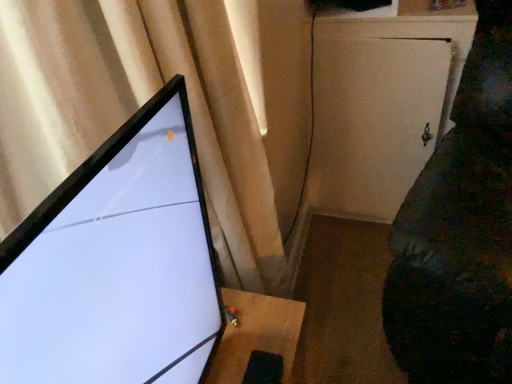
Identify the location of matte beige curtain at upper left. The height and width of the screenshot is (384, 512). (134, 111).

Find the location of a particular element. The width and height of the screenshot is (512, 384). matte beige curtain at upper left is located at coordinates (134, 111).

Is velvet dark green couch at right aimed at matte black monitor at left?

No, velvet dark green couch at right is not aimed at matte black monitor at left.

From the image's perspective, is velvet dark green couch at right located above matte black monitor at left?

Yes.

Is velvet dark green couch at right beside matte black monitor at left?

velvet dark green couch at right and matte black monitor at left are clearly separated.

Between velvet dark green couch at right and matte black monitor at left, which one appears on the right side from the viewer's perspective?

velvet dark green couch at right is more to the right.

Is white matte cabinet at right completely or partially outside of matte black monitor at left?

Yes, white matte cabinet at right is located beyond the bounds of matte black monitor at left.

Considering the positions of objects white matte cabinet at right and matte black monitor at left in the image provided, who is in front, white matte cabinet at right or matte black monitor at left?

Positioned in front is matte black monitor at left.

Can you confirm if white matte cabinet at right is wider than matte black monitor at left?

Yes, white matte cabinet at right is wider than matte black monitor at left.

Is matte beige curtain at upper left far from white matte cabinet at right?

matte beige curtain at upper left is actually quite close to white matte cabinet at right.

Is matte beige curtain at upper left bigger than white matte cabinet at right?

Indeed, matte beige curtain at upper left has a larger size compared to white matte cabinet at right.

Does matte beige curtain at upper left appear on the left side of white matte cabinet at right?

Yes.

Could you tell me if matte black monitor at left is turned towards matte beige curtain at upper left?

No.

Considering the sizes of objects matte black monitor at left and matte beige curtain at upper left in the image provided, who is bigger, matte black monitor at left or matte beige curtain at upper left?

Bigger between the two is matte beige curtain at upper left.

Is point (4, 268) in front of point (85, 48)?

Yes, it is in front of point (85, 48).

In the image, is matte black monitor at left positioned in front of or behind matte beige curtain at upper left?

Visually, matte black monitor at left is located in front of matte beige curtain at upper left.

Which object is positioned more to the right, velvet dark green couch at right or white matte cabinet at right?

velvet dark green couch at right.

Between velvet dark green couch at right and white matte cabinet at right, which one has smaller width?

white matte cabinet at right.

At what (x,y) coordinates should I click in order to perform the action: click on screen door above the velvet dark green couch at right (from a real-world perspective). Please return your answer as a coordinate pair (x, y). This screenshot has width=512, height=384. Looking at the image, I should click on (374, 122).

Is white matte cabinet at right a part of velvet dark green couch at right?

Actually, white matte cabinet at right is outside velvet dark green couch at right.

Is matte beige curtain at upper left not close to velvet dark green couch at right?

That's not correct — matte beige curtain at upper left is a little close to velvet dark green couch at right.

Between matte beige curtain at upper left and velvet dark green couch at right, which one has more height?

matte beige curtain at upper left is taller.

Considering the relative positions of matte beige curtain at upper left and velvet dark green couch at right in the image provided, is matte beige curtain at upper left to the left or to the right of velvet dark green couch at right?

Clearly, matte beige curtain at upper left is on the left of velvet dark green couch at right in the image.

Consider the image. Between matte beige curtain at upper left and velvet dark green couch at right, which one is positioned behind?

velvet dark green couch at right.

From the image's perspective, is matte black monitor at left under velvet dark green couch at right?

Yes, from the image's perspective, matte black monitor at left is below velvet dark green couch at right.

Which is more to the right, matte black monitor at left or velvet dark green couch at right?

velvet dark green couch at right.

Find the location of a particular element. This screenshot has height=384, width=512. computer monitor that is above the velvet dark green couch at right (from a real-world perspective) is located at coordinates (115, 263).

Identify the location of computer monitor to the left of velvet dark green couch at right. The image size is (512, 384). (115, 263).

You are a GUI agent. You are given a task and a screenshot of the screen. Output one action in this format:
    pyautogui.click(x=<x>, y=<y>)
    Task: Click on the screen door on the right of matte black monitor at left
    
    Given the screenshot: What is the action you would take?
    pyautogui.click(x=374, y=122)

When comparing their distances from matte beige curtain at upper left, does velvet dark green couch at right or matte black monitor at left seem further?

Among the two, velvet dark green couch at right is located further to matte beige curtain at upper left.

Considering their positions, is matte beige curtain at upper left positioned further to white matte cabinet at right than velvet dark green couch at right?

The object further to white matte cabinet at right is matte beige curtain at upper left.

When comparing their distances from white matte cabinet at right, does matte black monitor at left or velvet dark green couch at right seem closer?

velvet dark green couch at right.

From the image, which object appears to be farther from matte beige curtain at upper left, matte black monitor at left or velvet dark green couch at right?

velvet dark green couch at right is positioned further to the anchor matte beige curtain at upper left.

Estimate the real-world distances between objects in this image. Which object is closer to velvet dark green couch at right, matte black monitor at left or matte beige curtain at upper left?

Based on the image, matte beige curtain at upper left appears to be nearer to velvet dark green couch at right.

Considering their positions, is matte beige curtain at upper left positioned further to velvet dark green couch at right than white matte cabinet at right?

The object further to velvet dark green couch at right is matte beige curtain at upper left.

When comparing their distances from matte beige curtain at upper left, does velvet dark green couch at right or white matte cabinet at right seem further?

Based on the image, white matte cabinet at right appears to be further to matte beige curtain at upper left.

Estimate the real-world distances between objects in this image. Which object is closer to white matte cabinet at right, matte beige curtain at upper left or matte black monitor at left?

Among the two, matte beige curtain at upper left is located nearer to white matte cabinet at right.

Locate an element on the screen. The width and height of the screenshot is (512, 384). screen door between matte beige curtain at upper left and velvet dark green couch at right is located at coordinates (374, 122).

You are a GUI agent. You are given a task and a screenshot of the screen. Output one action in this format:
    pyautogui.click(x=<x>, y=<y>)
    Task: Click on the curtain between matte black monitor at left and white matte cabinet at right along the z-axis
    This screenshot has height=384, width=512.
    Given the screenshot: What is the action you would take?
    pyautogui.click(x=134, y=111)

In order to click on couch between matte black monitor at left and white matte cabinet at right from front to back in this screenshot , I will do `click(460, 231)`.

I want to click on computer monitor located between matte beige curtain at upper left and velvet dark green couch at right in the left-right direction, so click(115, 263).